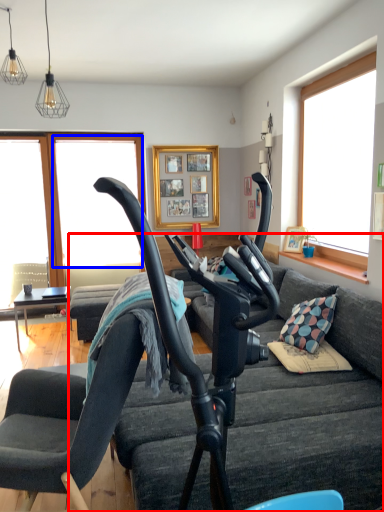
Question: Which point is closer to the camera, studio couch (highlighted by a red box) or window screen (highlighted by a blue box)?

Choices:
 (A) studio couch
 (B) window screen

Answer: (A)